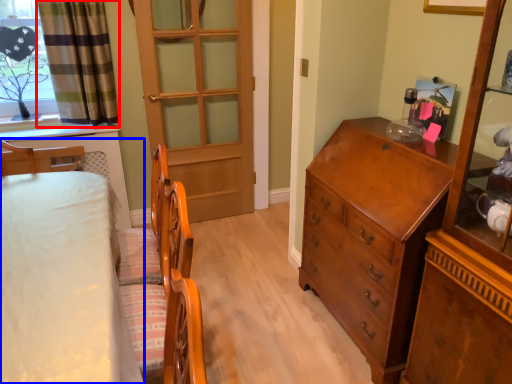
Question: Among these objects, which one is farthest to the camera, curtain (highlighted by a red box) or bed (highlighted by a blue box)?

Choices:
 (A) curtain
 (B) bed

Answer: (A)